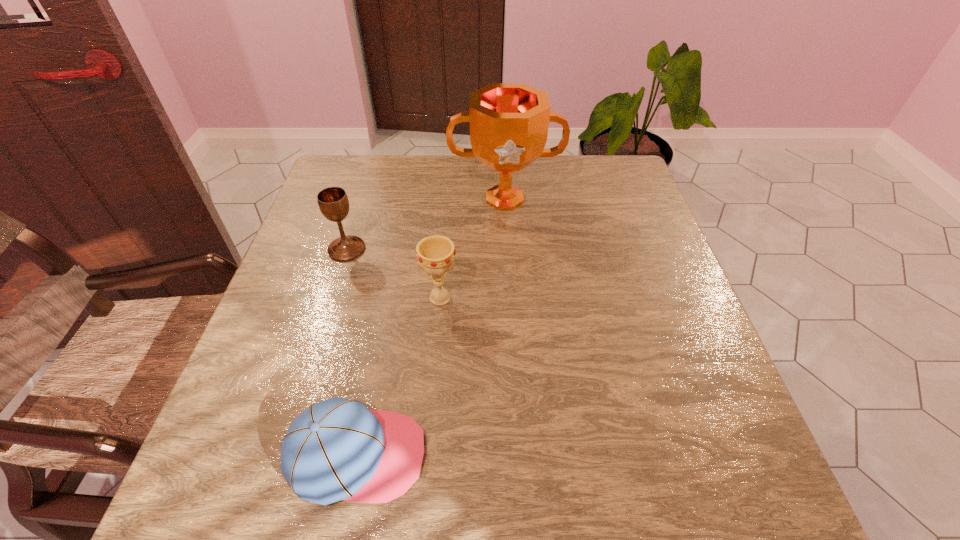
Identify the location of award. (509, 122).

Where is `the farthest object`? The height and width of the screenshot is (540, 960). the farthest object is located at coordinates (509, 122).

The height and width of the screenshot is (540, 960). In order to click on the left chalice in this screenshot , I will do `click(333, 202)`.

In order to click on the second farthest object in this screenshot , I will do `click(333, 202)`.

The image size is (960, 540). I want to click on the right chalice, so click(x=435, y=254).

Find the location of `the third farthest object`. the third farthest object is located at coordinates (435, 254).

The width and height of the screenshot is (960, 540). I want to click on the nearest object, so click(x=337, y=449).

You are a GUI agent. You are given a task and a screenshot of the screen. Output one action in this format:
    pyautogui.click(x=<x>, y=<y>)
    Task: Click on the shortest object
    The image size is (960, 540).
    Given the screenshot: What is the action you would take?
    pyautogui.click(x=337, y=449)

Identify the location of vacant region located 0.200m on the side of the award with the star emblem. The width and height of the screenshot is (960, 540). (510, 276).

You are a GUI agent. You are given a task and a screenshot of the screen. Output one action in this format:
    pyautogui.click(x=<x>, y=<y>)
    Task: Click on the free point located 0.260m on the front of the farther chalice
    
    Given the screenshot: What is the action you would take?
    pyautogui.click(x=315, y=353)